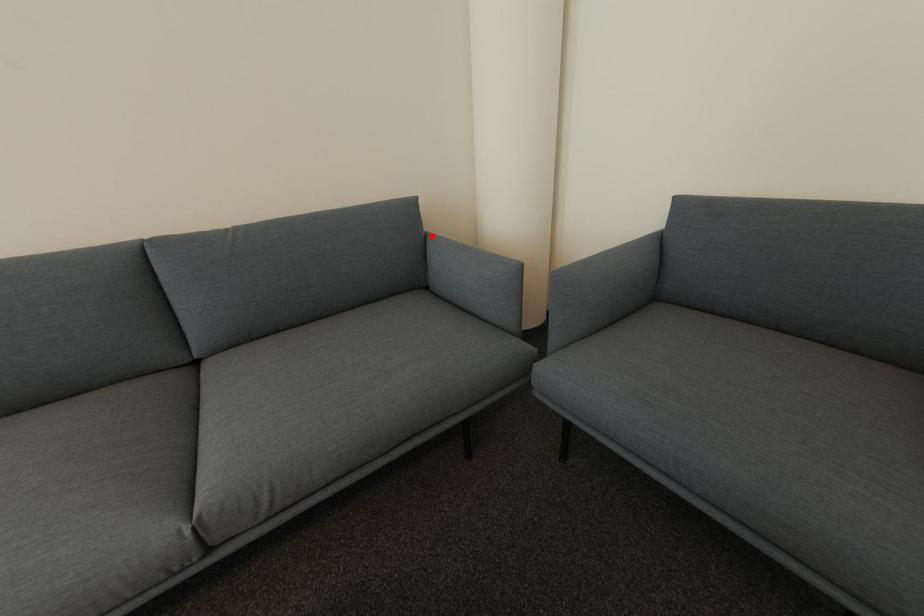
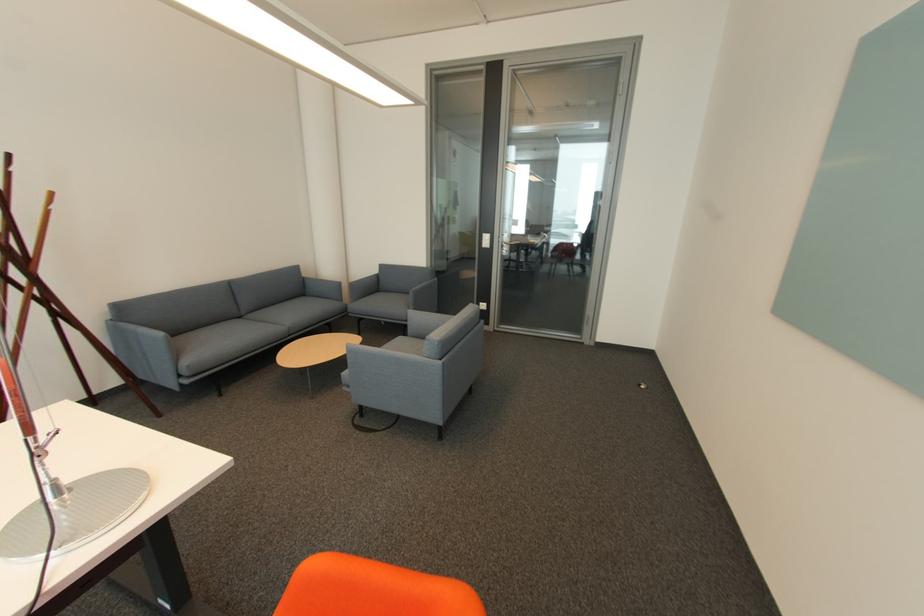
Question: I am providing you with two images of the same scene from different viewpoints. A red point is shown in image1. For the corresponding object point in image2, is it positioned nearer or farther from the camera?

Choices:
 (A) Nearer
 (B) Farther

Answer: (B)